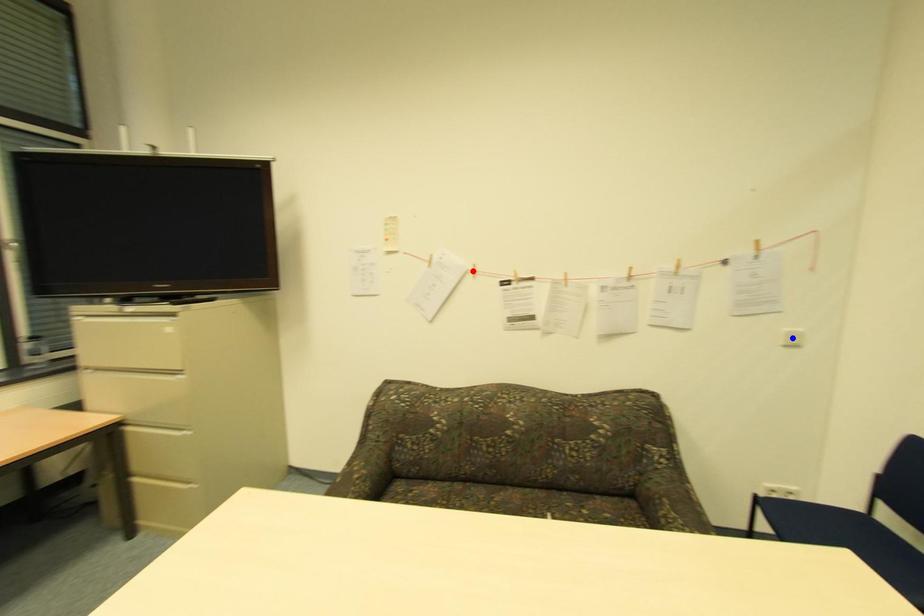
Question: In the image, two points are highlighted. Which point is nearer to the camera? Reply with the corresponding letter.

Choices:
 (A) blue point
 (B) red point

Answer: (A)